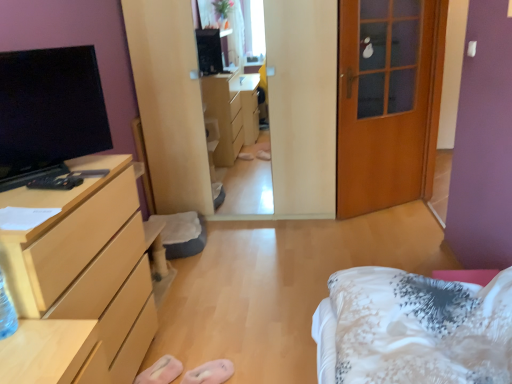
Question: Which direction should I rotate to look at pink fabric slipper at lower center, positioned as the 1th shoe in right-to-left order, — up or down?

Choices:
 (A) up
 (B) down

Answer: (B)

Question: Which direction should I rotate to look at pink fabric slipper at lower center, the second shoe in the right-to-left sequence?

Choices:
 (A) left
 (B) right

Answer: (A)

Question: Are pink fabric slipper at lower center, the 2th shoe positioned from the left, and light wood/finish chest of drawers at left making contact?

Choices:
 (A) yes
 (B) no

Answer: (B)

Question: Can light wood/finish chest of drawers at left be found inside pink fabric slipper at lower center, positioned as the 1th shoe in right-to-left order?

Choices:
 (A) yes
 (B) no

Answer: (B)

Question: From a real-world perspective, is pink fabric slipper at lower center, positioned as the 1th shoe in right-to-left order, beneath light wood/finish chest of drawers at left?

Choices:
 (A) no
 (B) yes

Answer: (B)

Question: Is pink fabric slipper at lower center, the 2th shoe positioned from the left, thinner than light wood/finish chest of drawers at left?

Choices:
 (A) no
 (B) yes

Answer: (B)

Question: Is pink fabric slipper at lower center, the 2th shoe positioned from the left, at the left side of light wood/finish chest of drawers at left?

Choices:
 (A) yes
 (B) no

Answer: (B)

Question: Is the position of pink fabric slipper at lower center, the 2th shoe positioned from the left, more distant than that of light wood/finish chest of drawers at left?

Choices:
 (A) yes
 (B) no

Answer: (A)

Question: Is light wood/finish chest of drawers at left positioned beyond the bounds of wooden door at right?

Choices:
 (A) no
 (B) yes

Answer: (B)

Question: From a real-world perspective, is light wood/finish chest of drawers at left below wooden door at right?

Choices:
 (A) no
 (B) yes

Answer: (B)

Question: Can you confirm if light wood/finish chest of drawers at left is wider than wooden door at right?

Choices:
 (A) yes
 (B) no

Answer: (A)

Question: Is light wood/finish chest of drawers at left not near wooden door at right?

Choices:
 (A) no
 (B) yes

Answer: (B)

Question: From the image's perspective, is light wood/finish chest of drawers at left located above wooden door at right?

Choices:
 (A) yes
 (B) no

Answer: (B)

Question: Is light wood/finish chest of drawers at left with wooden door at right?

Choices:
 (A) yes
 (B) no

Answer: (B)

Question: Is pink fabric slipper at lower center, positioned as the 1th shoe in right-to-left order, far away from black glossy tv at left?

Choices:
 (A) yes
 (B) no

Answer: (A)